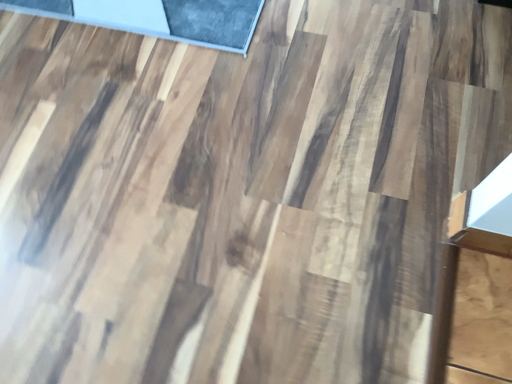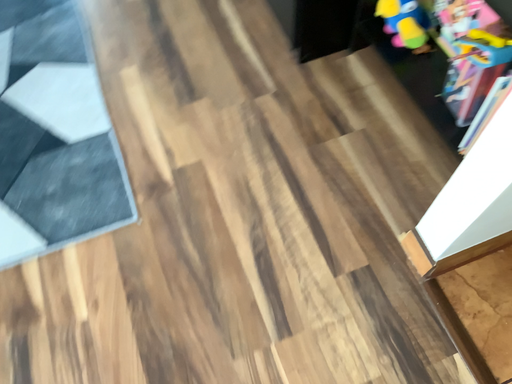
Question: Which way did the camera rotate in the video?

Choices:
 (A) rotated downward
 (B) rotated upward

Answer: (B)